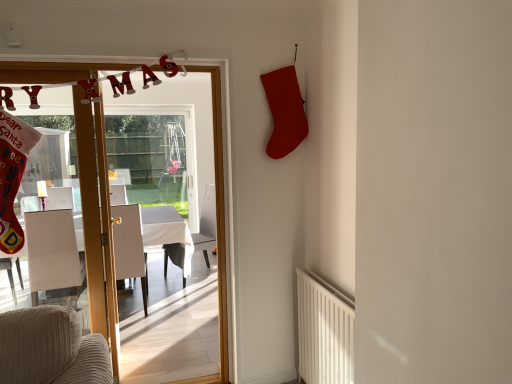
Image resolution: width=512 pixels, height=384 pixels. I want to click on vacant area on top of white textured radiator at lower right (from a real-world perspective), so click(333, 292).